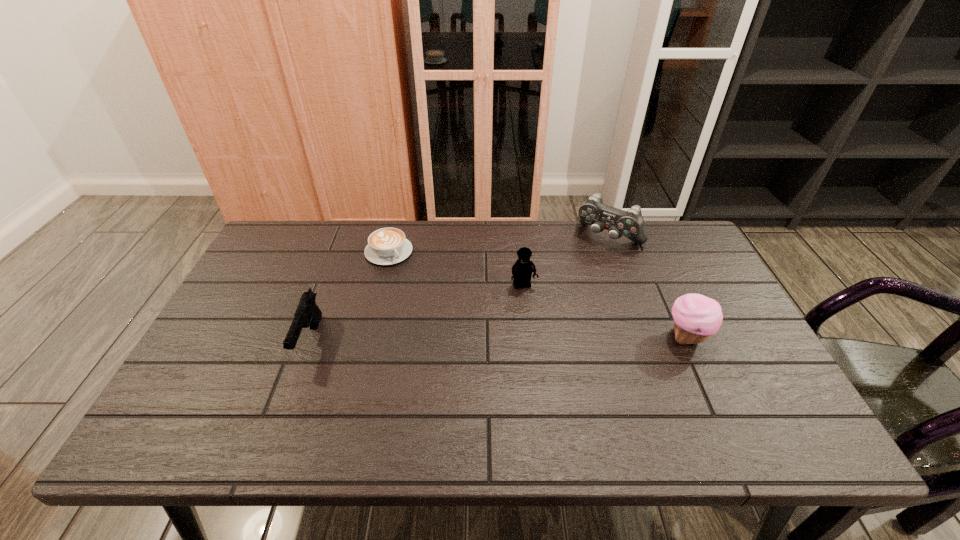
Where is `cupcake that is at the right edge`? The width and height of the screenshot is (960, 540). cupcake that is at the right edge is located at coordinates (696, 317).

Identify the location of control situated at the right edge. The image size is (960, 540). (630, 224).

In order to click on object at the far right corner in this screenshot , I will do `click(630, 224)`.

Find the location of a particular element. The height and width of the screenshot is (540, 960). free space at the far edge of the desktop is located at coordinates (553, 252).

What are the coordinates of `vacant region at the near edge of the desktop` in the screenshot? It's located at (280, 409).

Identify the location of vacant region at the left edge of the desktop. (238, 314).

Locate an element on the screen. blank space at the right edge of the desktop is located at coordinates (682, 292).

I want to click on vacant space at the far left corner of the desktop, so click(297, 261).

Image resolution: width=960 pixels, height=540 pixels. Identify the location of free space at the near right corner of the desktop. (730, 410).

Find the location of `unoccupied position between the cupcake and the pistol`. unoccupied position between the cupcake and the pistol is located at coordinates (498, 339).